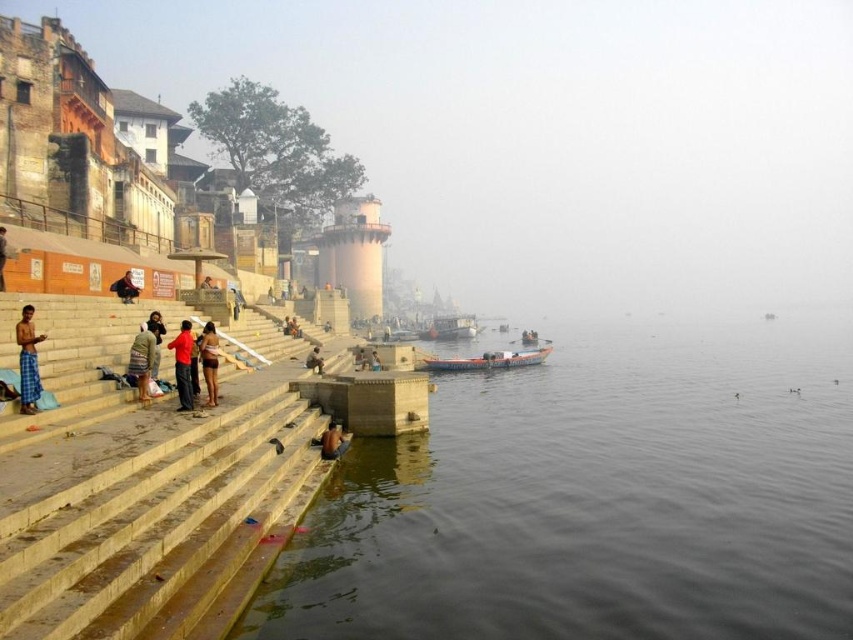
Question: Which point is closer to the camera?

Choices:
 (A) (149, 320)
 (B) (312, 365)
 (C) (457, 442)

Answer: (A)

Question: Which object is farther from the camera taking this photo?

Choices:
 (A) brown leather bag at lower center
 (B) matte brown shorts at center
 (C) matte black shorts at center
 (D) red cotton shirt at center

Answer: (A)

Question: Can you confirm if matte black shorts at center is thinner than red cotton shirt at center?

Choices:
 (A) yes
 (B) no

Answer: (B)

Question: Is dark gray water at lower center below dark blue fabric at lower center?

Choices:
 (A) no
 (B) yes

Answer: (B)

Question: Can you confirm if dark brown leather jacket at center is bigger than dark blue fabric at lower left?

Choices:
 (A) no
 (B) yes

Answer: (B)

Question: Which object appears farthest from the camera in this image?

Choices:
 (A) blue plaid shorts at lower left
 (B) red cotton shirt at center
 (C) dark blue fabric at lower center
 (D) dark gray water at lower center

Answer: (C)